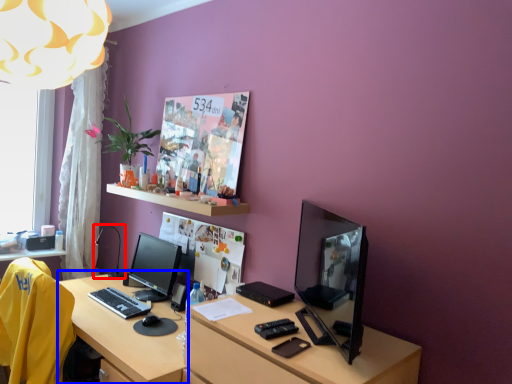
Question: Which object is further to the camera taking this photo, table lamp (highlighted by a red box) or vanity (highlighted by a blue box)?

Choices:
 (A) table lamp
 (B) vanity

Answer: (A)